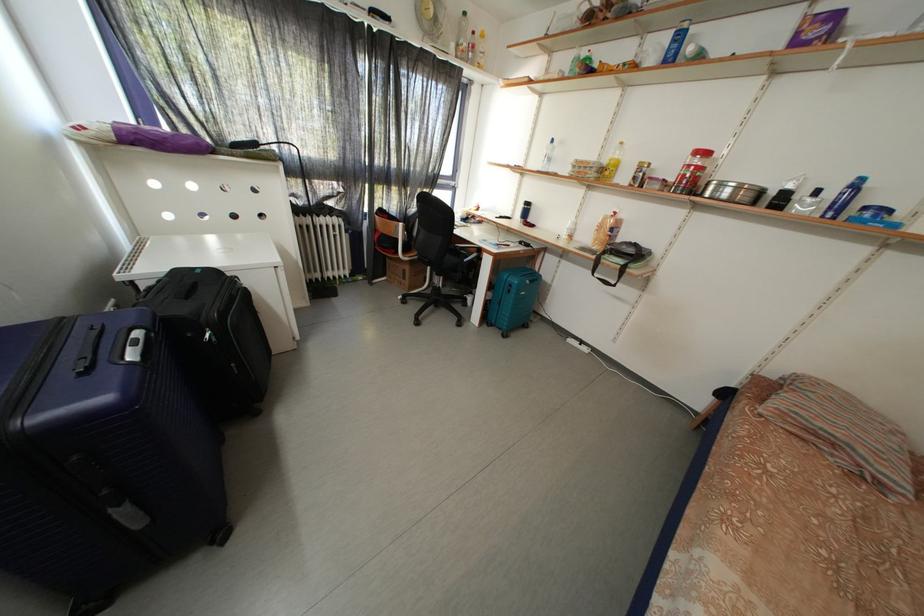
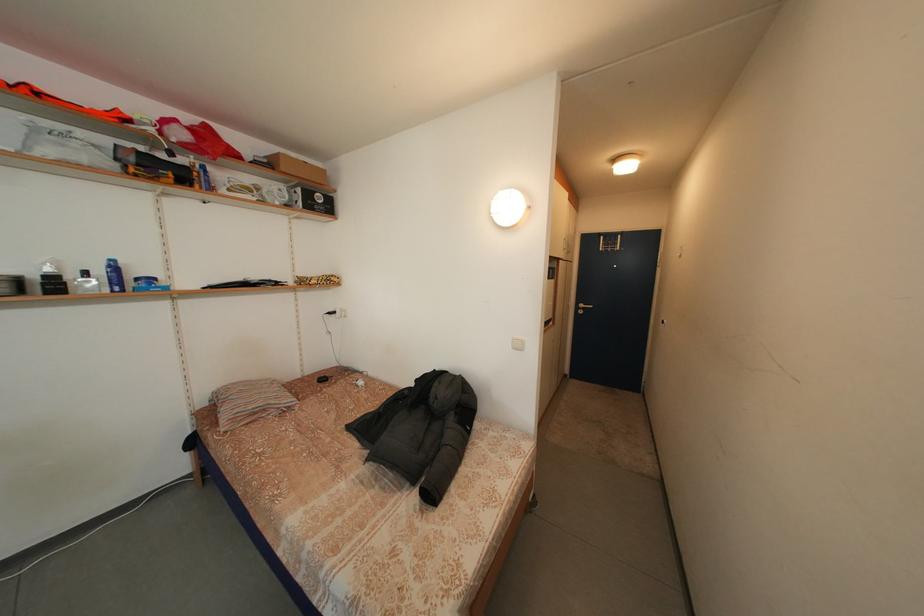
Locate, in the second image, the point that corresponds to (784,408) in the first image.

(233, 424)